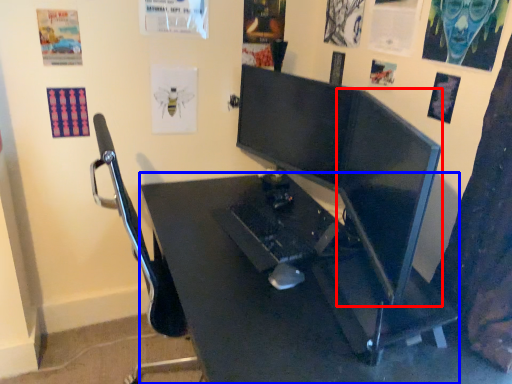
Question: Which object appears closest to the camera in this image, computer monitor (highlighted by a red box) or desk (highlighted by a blue box)?

Choices:
 (A) computer monitor
 (B) desk

Answer: (B)